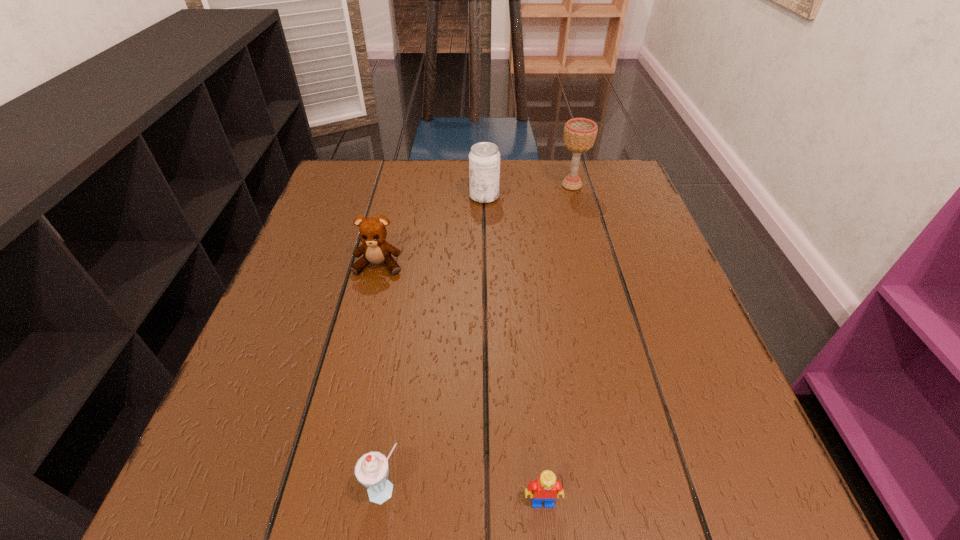
The height and width of the screenshot is (540, 960). What are the coordinates of `chalice` in the screenshot? It's located at (580, 134).

Locate an element on the screen. The height and width of the screenshot is (540, 960). the tallest object is located at coordinates (580, 134).

Where is `soda can`? This screenshot has width=960, height=540. soda can is located at coordinates (484, 158).

Locate an element on the screen. The width and height of the screenshot is (960, 540). the third farthest object is located at coordinates (375, 250).

Find the location of a particular element. Image resolution: width=960 pixels, height=540 pixels. the leftmost object is located at coordinates (375, 250).

Locate an element on the screen. Image resolution: width=960 pixels, height=540 pixels. the second object from left to right is located at coordinates (371, 470).

The image size is (960, 540). I want to click on the shortest object, so click(546, 488).

The image size is (960, 540). In order to click on the second object from right to left in this screenshot , I will do `click(546, 488)`.

You are a GUI agent. You are given a task and a screenshot of the screen. Output one action in this format:
    pyautogui.click(x=<x>, y=<y>)
    Task: Click on the vacant region located 0.170m on the left of the rightmost object
    This screenshot has height=540, width=960.
    Given the screenshot: What is the action you would take?
    (x=491, y=185)

You are a GUI agent. You are given a task and a screenshot of the screen. Output one action in this format:
    pyautogui.click(x=<x>, y=<y>)
    Task: Click on the free space located 0.340m on the left of the soda can
    The width and height of the screenshot is (960, 540).
    Given the screenshot: What is the action you would take?
    pyautogui.click(x=333, y=197)